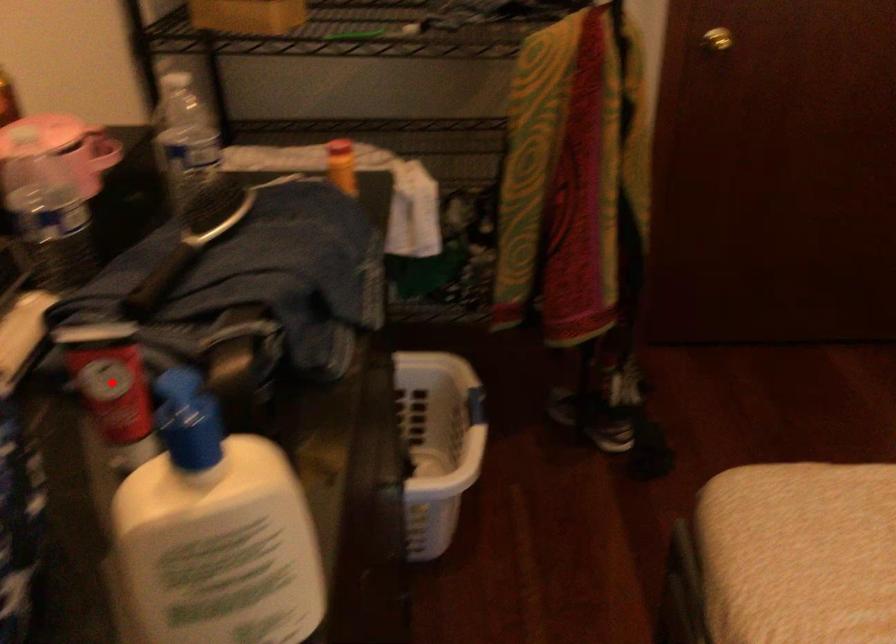
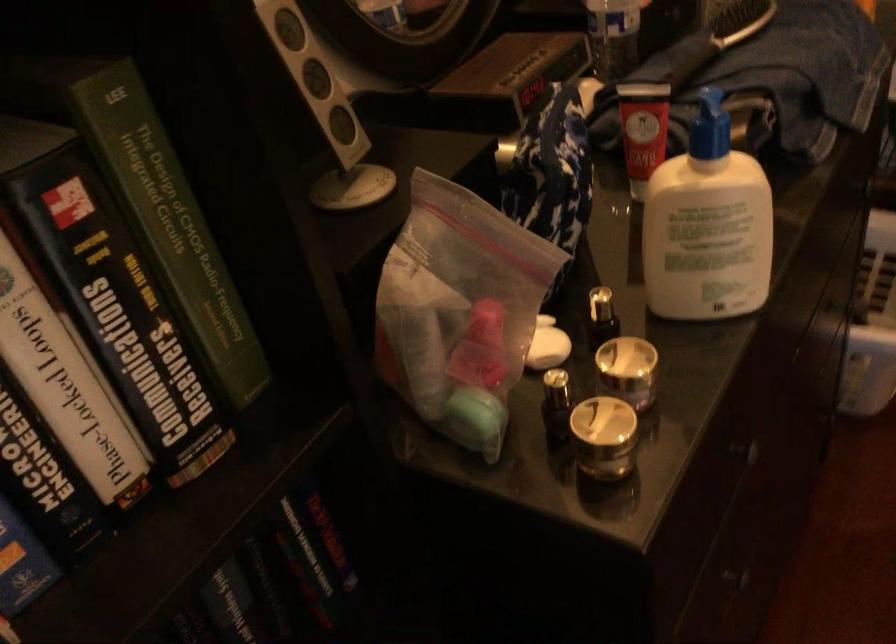
Question: I am providing you with two images of the same scene from different viewpoints. A red point is marked on the first image. Is the red point's position out of view in image 2?

Choices:
 (A) Yes
 (B) No

Answer: (B)